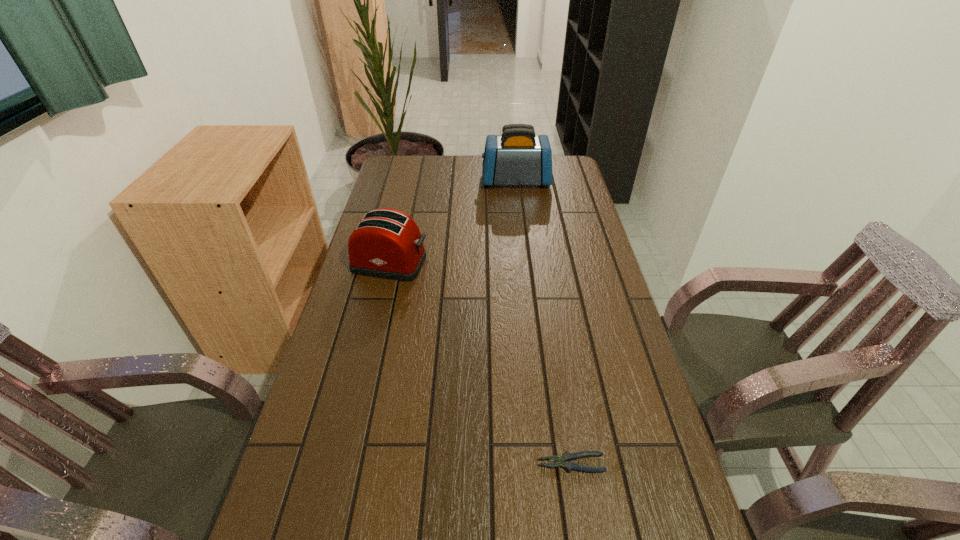
I want to click on free location at the right edge, so click(636, 451).

You are a GUI agent. You are given a task and a screenshot of the screen. Output one action in this format:
    pyautogui.click(x=<x>, y=<y>)
    Task: Click on the blank space at the far left corner
    
    Given the screenshot: What is the action you would take?
    pyautogui.click(x=417, y=180)

The width and height of the screenshot is (960, 540). What are the coordinates of `empty space that is in between the left toaster and the pliers` in the screenshot? It's located at (481, 363).

Locate an element on the screen. This screenshot has height=540, width=960. empty space between the pliers and the nearer toaster is located at coordinates (481, 363).

This screenshot has height=540, width=960. Identify the location of free space between the shorter toaster and the farthest object. (453, 222).

The height and width of the screenshot is (540, 960). I want to click on vacant area that lies between the second nearest object and the tallest object, so click(x=453, y=222).

At what (x,y) coordinates should I click in order to perform the action: click on vacant area that lies between the farthest object and the second farthest object. Please return your answer as a coordinate pair (x, y). This screenshot has width=960, height=540. Looking at the image, I should click on (453, 222).

Where is `free area in between the nearest object and the tallest object`? Image resolution: width=960 pixels, height=540 pixels. free area in between the nearest object and the tallest object is located at coordinates (543, 322).

Find the location of a particular element. The height and width of the screenshot is (540, 960). vacant space that is in between the second farthest object and the pliers is located at coordinates (481, 363).

Locate an element on the screen. free space between the tallest object and the shortest object is located at coordinates (543, 322).